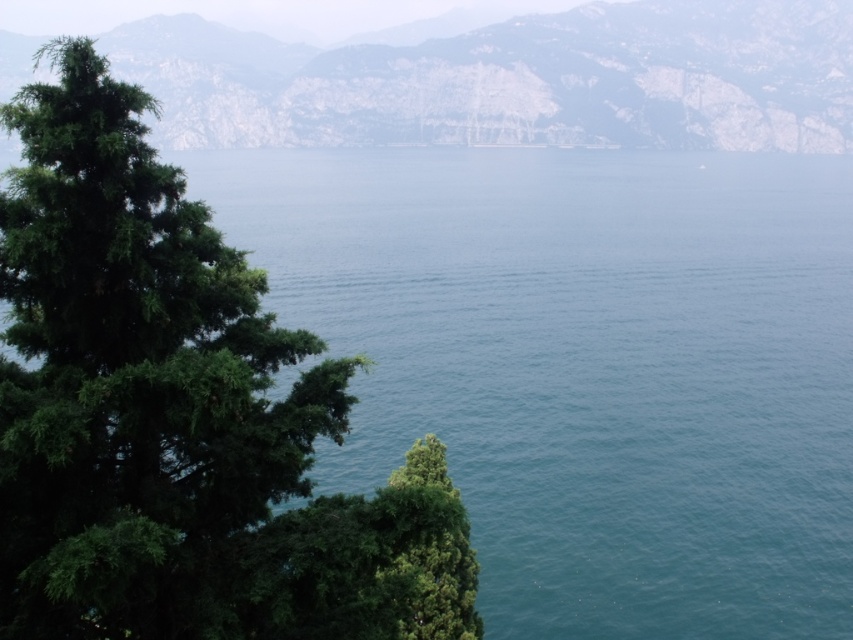
Between green leafy tree at left and green textured mountain at upper center, which one has more height?

green textured mountain at upper center is taller.

Between point (424, 556) and point (695, 90), which one is positioned in front?

Point (424, 556)

Is point (183, 538) positioned after point (569, 32)?

No, it is not.

Locate an element on the screen. green leafy tree at left is located at coordinates (178, 416).